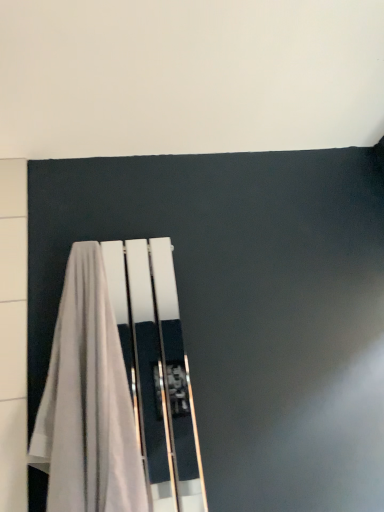
Describe the element at coordinates (88, 402) in the screenshot. I see `white fabric towel at left` at that location.

The height and width of the screenshot is (512, 384). I want to click on white fabric towel at left, so click(x=88, y=402).

Where is `white fabric towel at left`? white fabric towel at left is located at coordinates (88, 402).